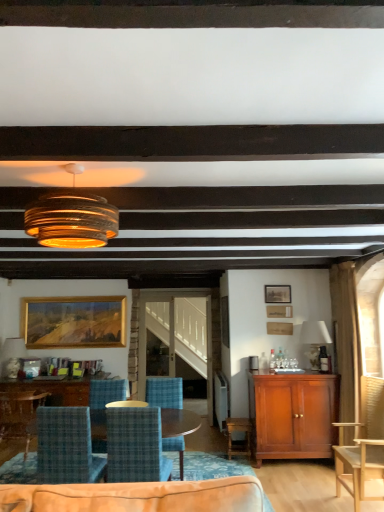
Question: Is blue plaid fabric chair at center, which ranks as the 2th chair in right-to-left order, shorter than white fabric lampshade at right, arranged as the 2th lamp when viewed from the front?

Choices:
 (A) no
 (B) yes

Answer: (A)

Question: Can you confirm if blue plaid fabric chair at center, arranged as the fourth chair when viewed from the left, is thinner than white fabric lampshade at right, arranged as the 2th lamp when viewed from the front?

Choices:
 (A) yes
 (B) no

Answer: (B)

Question: Does blue plaid fabric chair at center, which ranks as the 2th chair in right-to-left order, appear on the right side of white fabric lampshade at right, positioned as the third lamp in left-to-right order?

Choices:
 (A) no
 (B) yes

Answer: (A)

Question: Is blue plaid fabric chair at center, arranged as the fourth chair when viewed from the left, outside of white fabric lampshade at right, which is counted as the 2th lamp, starting from the back?

Choices:
 (A) no
 (B) yes

Answer: (B)

Question: Is blue plaid fabric chair at center, which ranks as the 2th chair in right-to-left order, oriented towards white fabric lampshade at right, which ranks as the first lamp in right-to-left order?

Choices:
 (A) no
 (B) yes

Answer: (A)

Question: From the image's perspective, relative to clear glass door at center, is white fabric lampshade at right, arranged as the 2th lamp when viewed from the front, above or below?

Choices:
 (A) above
 (B) below

Answer: (A)

Question: Based on their sizes in the image, would you say white fabric lampshade at right, positioned as the third lamp in left-to-right order, is bigger or smaller than clear glass door at center?

Choices:
 (A) small
 (B) big

Answer: (A)

Question: Is white fabric lampshade at right, which ranks as the 2th lamp in bottom-to-top order, spatially inside clear glass door at center, or outside of it?

Choices:
 (A) outside
 (B) inside

Answer: (A)

Question: Considering the positions of point click(x=324, y=333) and point click(x=142, y=352), is point click(x=324, y=333) closer or farther from the camera than point click(x=142, y=352)?

Choices:
 (A) closer
 (B) farther

Answer: (B)

Question: Considering the positions of white fabric lampshade at right, which is counted as the 2th lamp, starting from the back, and wooden picture frame at upper right, placed as the first picture frame when sorted from front to back, in the image, is white fabric lampshade at right, which is counted as the 2th lamp, starting from the back, taller or shorter than wooden picture frame at upper right, placed as the first picture frame when sorted from front to back,?

Choices:
 (A) tall
 (B) short

Answer: (A)

Question: Would you say white fabric lampshade at right, positioned as the third lamp in left-to-right order, is to the left or to the right of wooden picture frame at upper right, which is counted as the 2th picture frame, starting from the back, in the picture?

Choices:
 (A) left
 (B) right

Answer: (B)

Question: From a real-world perspective, is white fabric lampshade at right, positioned as the third lamp in left-to-right order, above or below wooden picture frame at upper right, positioned as the 1th picture frame in right-to-left order?

Choices:
 (A) above
 (B) below

Answer: (B)

Question: Is point [317, 345] positioned closer to the camera than point [273, 289]?

Choices:
 (A) closer
 (B) farther

Answer: (B)

Question: From their relative heights in the image, would you say blue plaid fabric chair at center, arranged as the third chair when viewed from the right, is taller or shorter than wooden picture frame at upper right, the 2th picture frame in the left-to-right sequence?

Choices:
 (A) tall
 (B) short

Answer: (A)

Question: Looking at their shapes, would you say blue plaid fabric chair at center, which appears as the third chair when viewed from the left, is wider or thinner than wooden picture frame at upper right, placed as the first picture frame when sorted from front to back?

Choices:
 (A) wide
 (B) thin

Answer: (A)